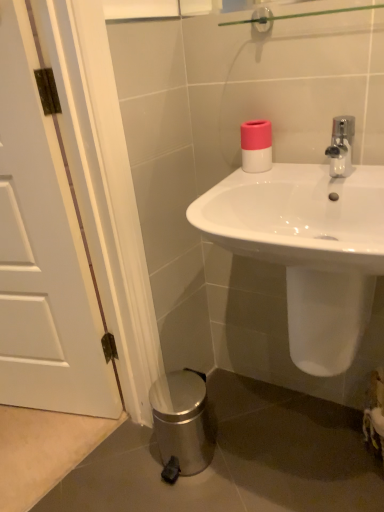
What do you see at coordinates (256, 146) in the screenshot? I see `pink matte toilet paper at upper right` at bounding box center [256, 146].

You are a GUI agent. You are given a task and a screenshot of the screen. Output one action in this format:
    pyautogui.click(x=<x>, y=<y>)
    Task: Click on the white matte door at left
    
    Given the screenshot: What is the action you would take?
    pyautogui.click(x=42, y=253)

Find the location of a particular element. The width and height of the screenshot is (384, 512). pink matte toilet paper at upper right is located at coordinates (256, 146).

Is pink matte toilet paper at upper right surrounded by white matte door at left?

No, white matte door at left does not contain pink matte toilet paper at upper right.

Can you confirm if white matte door at left is thinner than pink matte toilet paper at upper right?

Incorrect, the width of white matte door at left is not less than that of pink matte toilet paper at upper right.

Does white matte door at left have a larger size compared to pink matte toilet paper at upper right?

Yes.

From a real-world perspective, between white glossy sink at center and pink matte toilet paper at upper right, who is vertically higher?

From a 3D spatial view, pink matte toilet paper at upper right is above.

Is white glossy sink at center thinner than pink matte toilet paper at upper right?

In fact, white glossy sink at center might be wider than pink matte toilet paper at upper right.

From the image's perspective, which object appears higher, white glossy sink at center or pink matte toilet paper at upper right?

From the image's view, pink matte toilet paper at upper right is above.

In terms of height, does pink matte toilet paper at upper right look taller or shorter compared to white matte door at left?

Considering their sizes, pink matte toilet paper at upper right has less height than white matte door at left.

Can you tell me how much pink matte toilet paper at upper right and white matte door at left differ in facing direction?

The angle between the facing direction of pink matte toilet paper at upper right and the facing direction of white matte door at left is 13.9 degrees.

Is pink matte toilet paper at upper right oriented away from white matte door at left?

No.

Looking at this image, does pink matte toilet paper at upper right have a greater width compared to white matte door at left?

No.

Locate an element on the screen. The width and height of the screenshot is (384, 512). door above the white glossy sink at center (from the image's perspective) is located at coordinates [x=42, y=253].

Which is behind, white glossy sink at center or white matte door at left?

Positioned behind is white matte door at left.

Are white glossy sink at center and white matte door at left far apart?

white glossy sink at center is actually quite close to white matte door at left.

This screenshot has height=512, width=384. In order to click on toilet paper that is above the white glossy sink at center (from the image's perspective) in this screenshot , I will do `click(256, 146)`.

Which of these two, pink matte toilet paper at upper right or white glossy sink at center, stands taller?

With more height is white glossy sink at center.

In the scene shown: Considering the sizes of pink matte toilet paper at upper right and white glossy sink at center in the image, is pink matte toilet paper at upper right bigger or smaller than white glossy sink at center?

Clearly, pink matte toilet paper at upper right is smaller in size than white glossy sink at center.

Considering the relative positions of pink matte toilet paper at upper right and white glossy sink at center in the image provided, is pink matte toilet paper at upper right to the right of white glossy sink at center from the viewer's perspective?

In fact, pink matte toilet paper at upper right is to the left of white glossy sink at center.

Is white matte door at left in front of or behind white glossy sink at center in the image?

white matte door at left is positioned farther from the viewer than white glossy sink at center.

Based on their sizes in the image, would you say white matte door at left is bigger or smaller than white glossy sink at center?

white matte door at left is smaller than white glossy sink at center.

Is white matte door at left not inside white glossy sink at center?

Yes.

At what (x,y) coordinates should I click in order to perform the action: click on door below the pink matte toilet paper at upper right (from the image's perspective). Please return your answer as a coordinate pair (x, y). The height and width of the screenshot is (512, 384). Looking at the image, I should click on (42, 253).

You are a GUI agent. You are given a task and a screenshot of the screen. Output one action in this format:
    pyautogui.click(x=<x>, y=<y>)
    Task: Click on the toilet paper on the left of white glossy sink at center
    This screenshot has height=512, width=384.
    Given the screenshot: What is the action you would take?
    pyautogui.click(x=256, y=146)

Looking at the image, which one is located further to white matte door at left, white glossy sink at center or pink matte toilet paper at upper right?

pink matte toilet paper at upper right is positioned further to the anchor white matte door at left.

Which object lies nearer to the anchor point white matte door at left, pink matte toilet paper at upper right or white glossy sink at center?

Based on the image, white glossy sink at center appears to be nearer to white matte door at left.

From the image, which object appears to be farther from white glossy sink at center, white matte door at left or pink matte toilet paper at upper right?

A: white matte door at left lies further to white glossy sink at center than the other object.

Based on their spatial positions, is white matte door at left or white glossy sink at center further from pink matte toilet paper at upper right?

Among the two, white matte door at left is located further to pink matte toilet paper at upper right.

Consider the image. Considering their positions, is white glossy sink at center positioned further to pink matte toilet paper at upper right than white matte door at left?

Based on the image, white matte door at left appears to be further to pink matte toilet paper at upper right.

Estimate the real-world distances between objects in this image. Which object is further from white glossy sink at center, pink matte toilet paper at upper right or white matte door at left?

Based on the image, white matte door at left appears to be further to white glossy sink at center.

Locate an element on the screen. Image resolution: width=384 pixels, height=512 pixels. toilet paper between white matte door at left and white glossy sink at center in the horizontal direction is located at coordinates (256, 146).